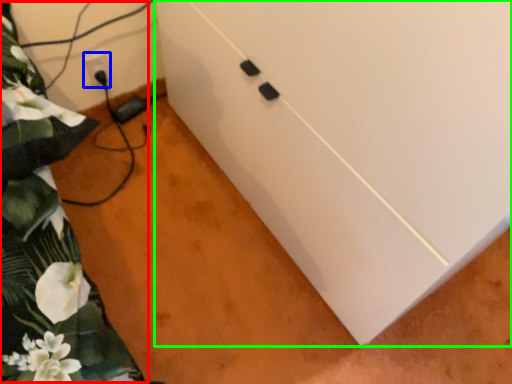
Question: Based on their relative distances, which object is farther from bed (highlighted by a red box)? Choose from electric outlet (highlighted by a blue box) and cabinetry (highlighted by a green box).

Choices:
 (A) electric outlet
 (B) cabinetry

Answer: (A)